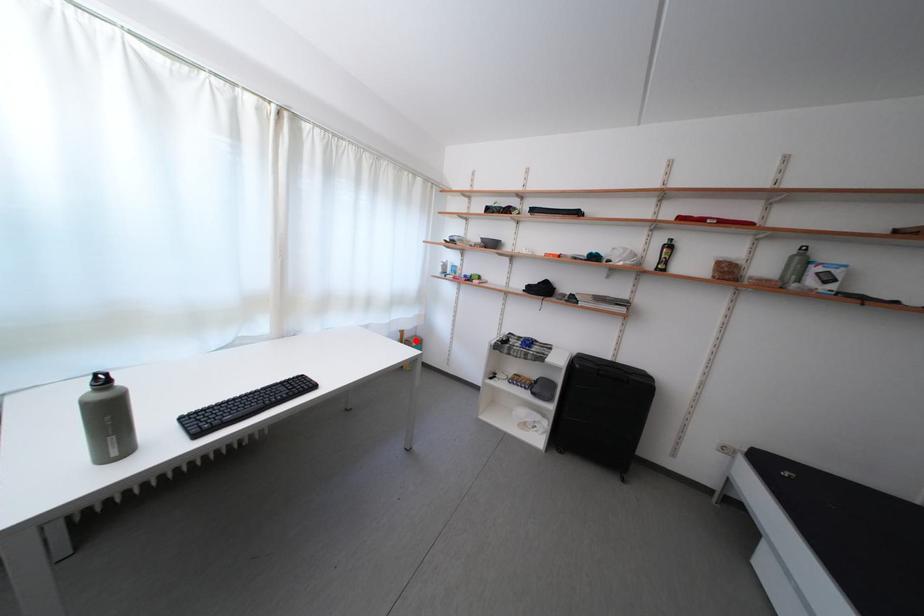
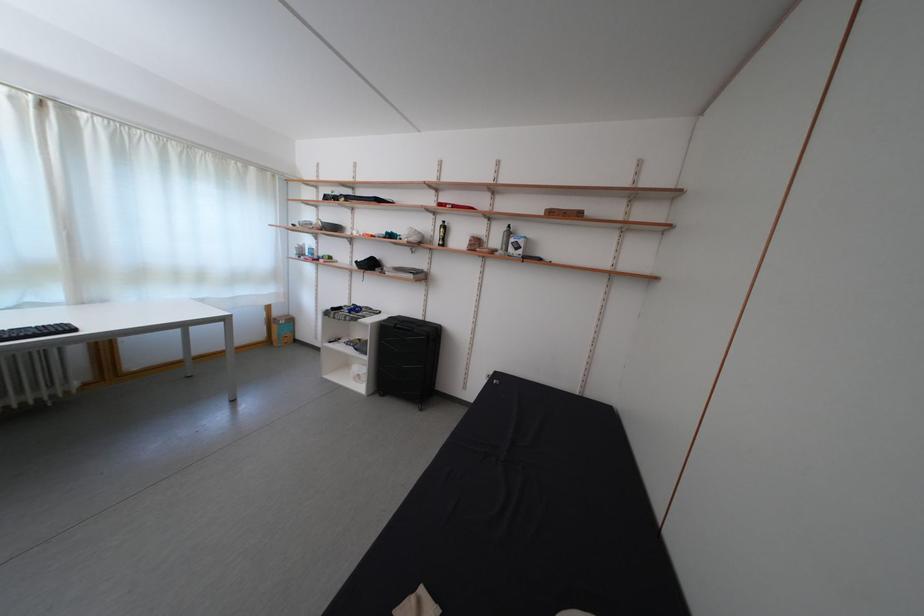
Find the pixel in the second image that matches the highlighted location in the first image.

(285, 320)